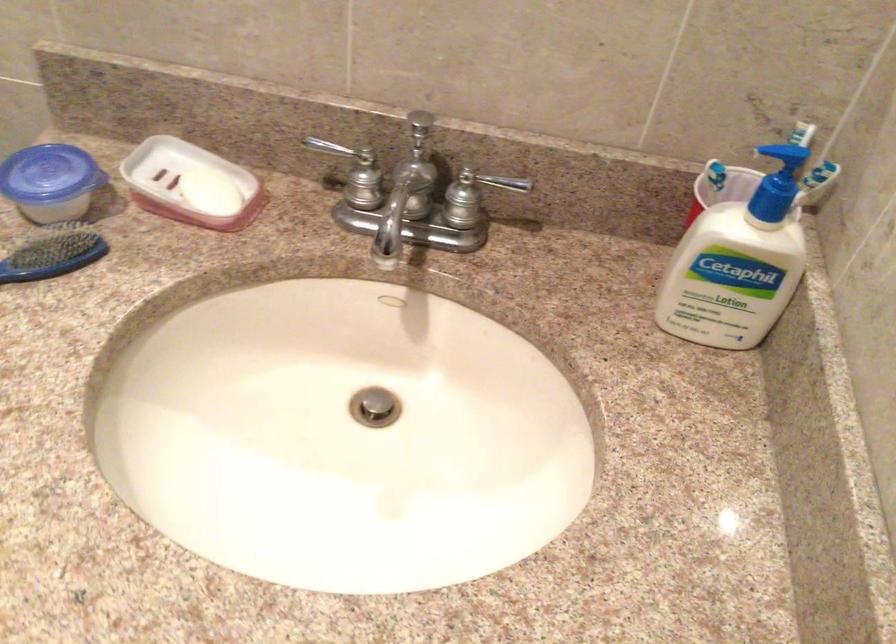
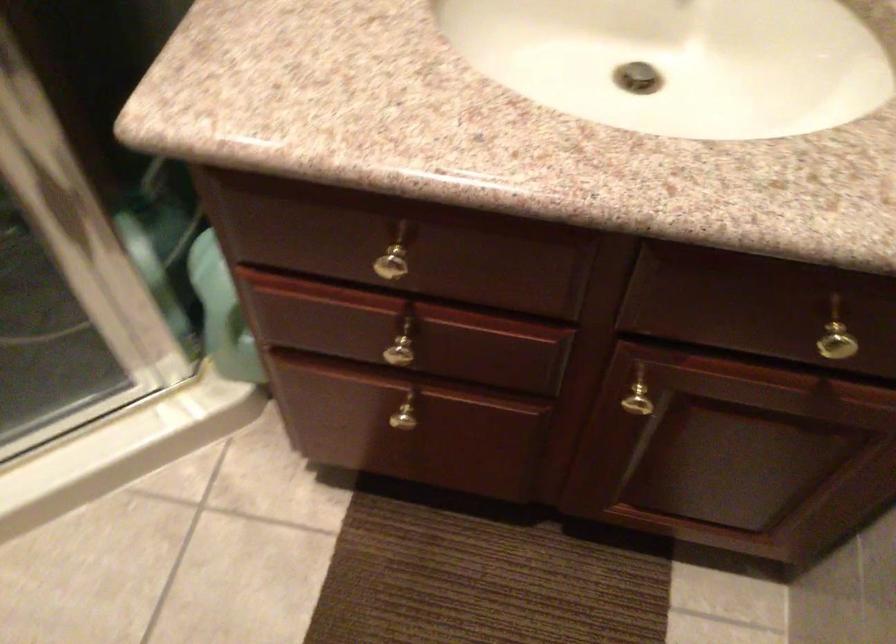
Question: Based on the continuous images, in which direction is the camera rotating? Reply with the corresponding letter.

Choices:
 (A) Left
 (B) Right
 (C) Up
 (D) Down

Answer: (D)